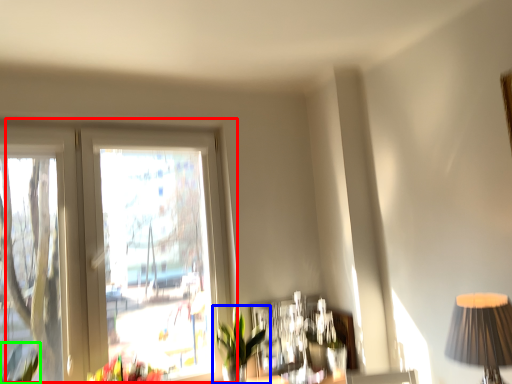
Question: Which object is positioned farthest from window (highlighted by a red box)? Select from houseplant (highlighted by a blue box) and plant (highlighted by a green box).

Choices:
 (A) houseplant
 (B) plant

Answer: (B)